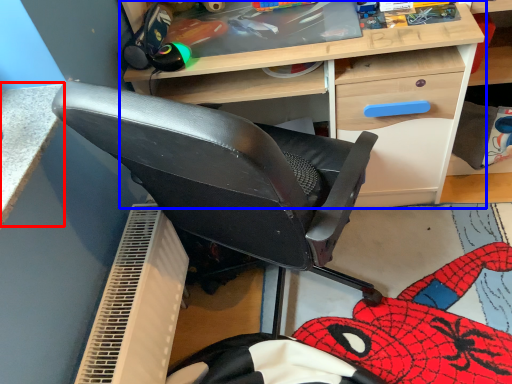
Question: Which point is closer to the camera, table (highlighted by a red box) or desk (highlighted by a blue box)?

Choices:
 (A) table
 (B) desk

Answer: (A)